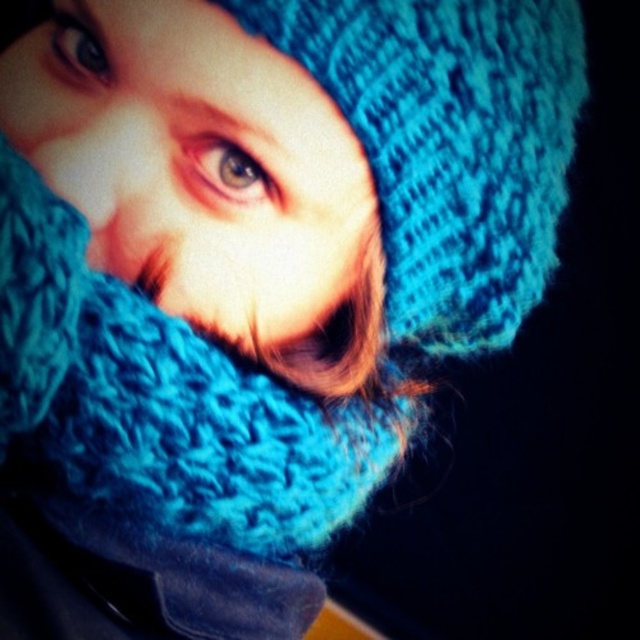
Question: Estimate the real-world distances between objects in this image. Which object is closer to the brown matte eye at upper center?

Choices:
 (A) blue knitted hat at upper center
 (B) matte blue eye at upper left

Answer: (A)

Question: Is blue knitted hat at upper center above brown matte eye at upper center?

Choices:
 (A) yes
 (B) no

Answer: (A)

Question: Is blue knitted hat at upper center smaller than brown matte eye at upper center?

Choices:
 (A) no
 (B) yes

Answer: (A)

Question: In this image, where is brown matte eye at upper center located relative to matte blue eye at upper left?

Choices:
 (A) above
 (B) below

Answer: (B)

Question: Among these objects, which one is nearest to the camera?

Choices:
 (A) blue knitted hat at upper center
 (B) matte blue eye at upper left
 (C) brown matte eye at upper center

Answer: (A)

Question: Which of the following is the closest to the observer?

Choices:
 (A) brown matte eye at upper center
 (B) matte blue eye at upper left
 (C) blue knitted hat at upper center

Answer: (C)